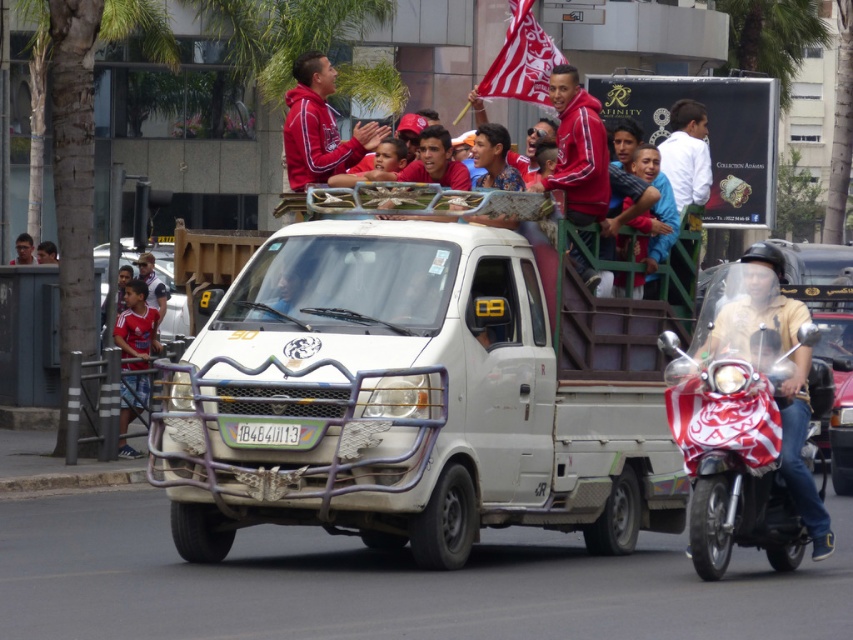
You are a pedestrian standing on the sidewalk watching the white matte truck at center and the red fleece jacket at upper center. Which object is closer to you?

The white matte truck at center is closer to you because it is positioned in front of the red fleece jacket at upper center, meaning it is nearer in the visual plane.